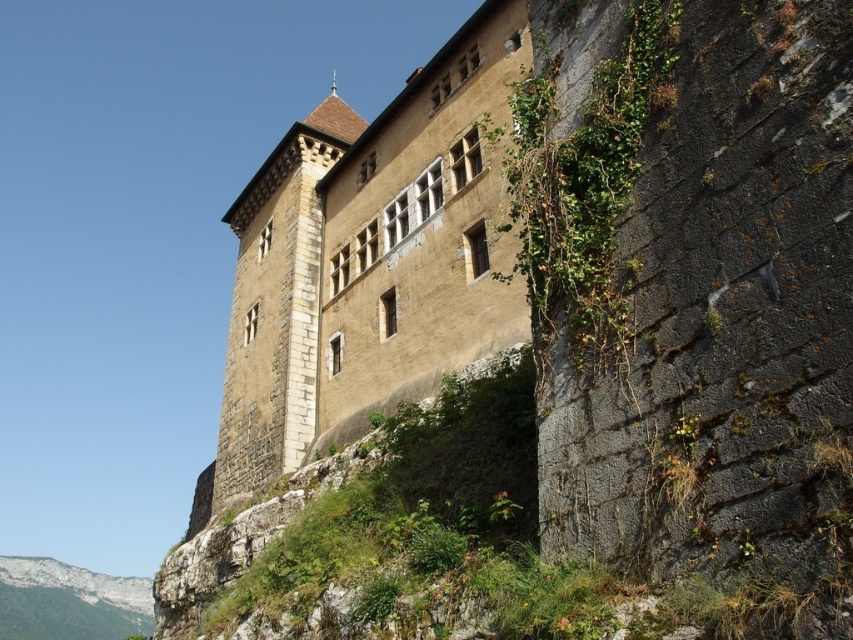
Question: Can you confirm if brown stone castle at center is smaller than brown stone tower at center?

Choices:
 (A) no
 (B) yes

Answer: (B)

Question: Which of the following is the closest to the observer?

Choices:
 (A) (344, 269)
 (B) (218, 486)

Answer: (A)

Question: Does brown stone castle at center appear on the left side of brown stone tower at center?

Choices:
 (A) yes
 (B) no

Answer: (B)

Question: Is brown stone castle at center positioned in front of brown stone tower at center?

Choices:
 (A) yes
 (B) no

Answer: (A)

Question: Which point is farther to the camera?

Choices:
 (A) (341, 120)
 (B) (415, 173)

Answer: (A)